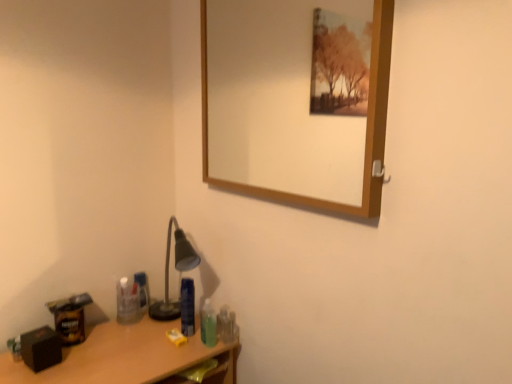
At what (x,y) coordinates should I click in order to perform the action: click on free area in between blue plastic bottle at lower center, the 2th toiletry from the left, and translucent plastic bottle at center, arranged as the fourth toiletry when viewed from the right. Please return your answer as a coordinate pair (x, y). Looking at the image, I should click on (166, 323).